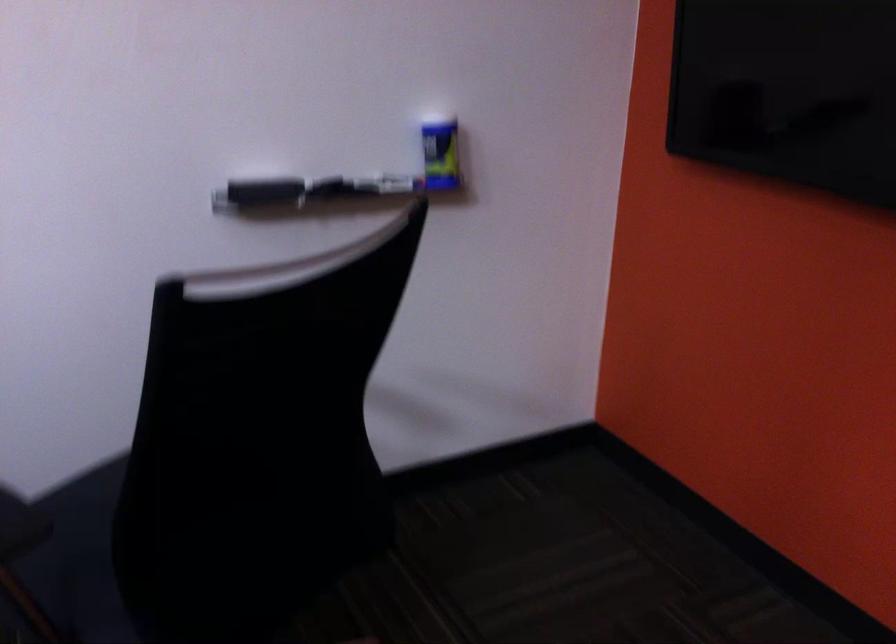
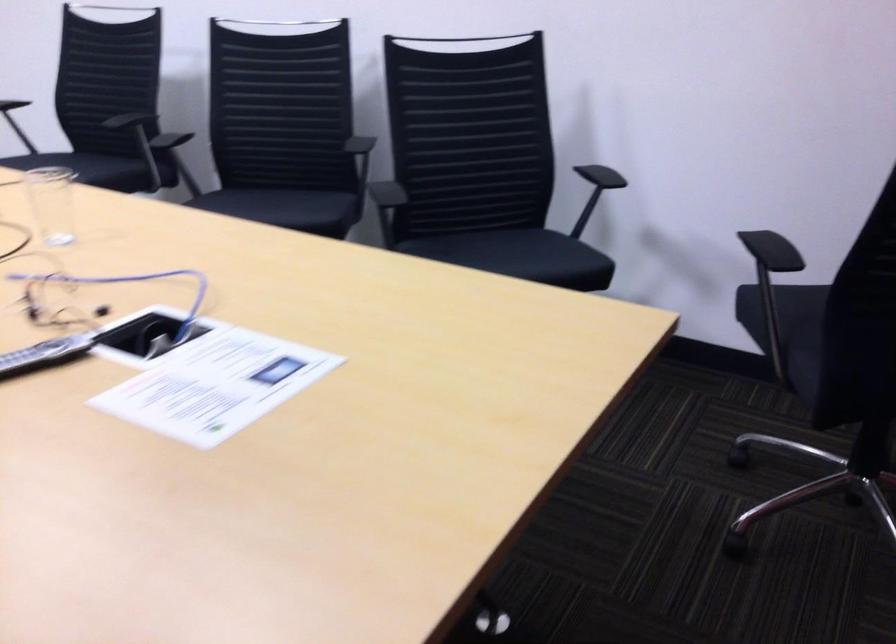
Question: The camera is either moving clockwise (left) or counter-clockwise (right) around the object. The first image is from the beginning of the video and the second image is from the end. Is the camera moving left or right when shooting the video?

Choices:
 (A) Left
 (B) Right

Answer: (B)